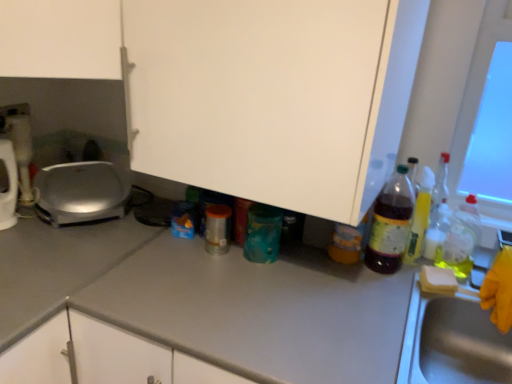
Identify the location of empty space that is to the right of white glossy kettle at left, which is the 3th appliance in right-to-left order. The height and width of the screenshot is (384, 512). (27, 230).